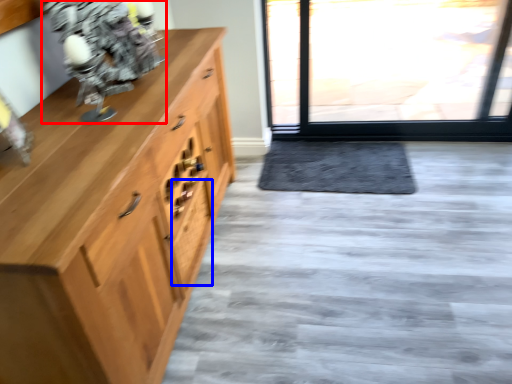
Question: Which of the following is the closest to the observer, figurine (highlighted by a red box) or drawer (highlighted by a blue box)?

Choices:
 (A) figurine
 (B) drawer

Answer: (A)